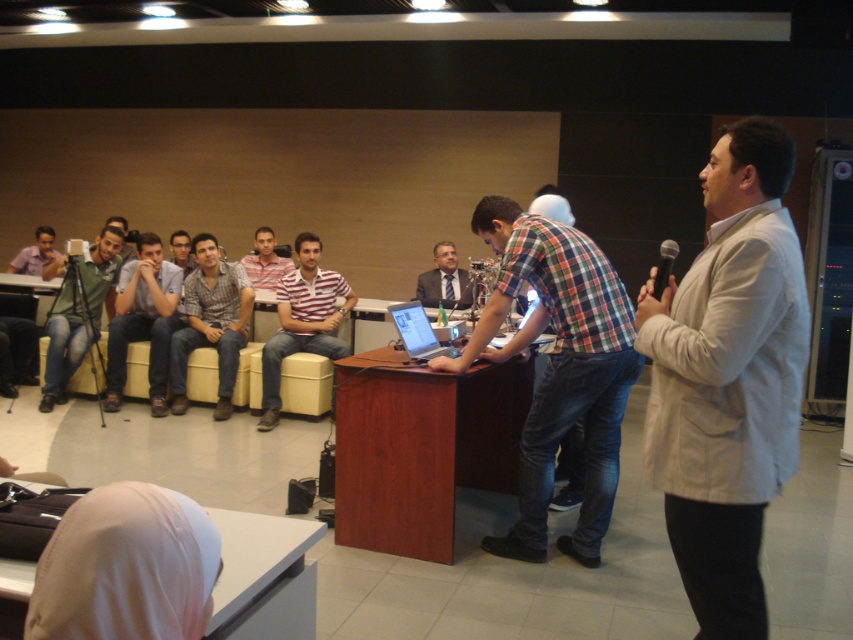
Question: Which of the following is the farthest from the observer?

Choices:
 (A) light blue shirt at center
 (B) beige fabric jacket at right
 (C) matte black suit at center
 (D) matte green shirt at left

Answer: (C)

Question: Is plaid fabric shirt at center thinner than plaid shirt at center?

Choices:
 (A) no
 (B) yes

Answer: (A)

Question: Is striped cotton shirt at center thinner than black plastic microphone at upper right?

Choices:
 (A) no
 (B) yes

Answer: (A)

Question: Is beige fabric jacket at right to the left of black plastic microphone at upper right from the viewer's perspective?

Choices:
 (A) yes
 (B) no

Answer: (A)

Question: Estimate the real-world distances between objects in this image. Which object is closer to the plaid fabric shirt at center?

Choices:
 (A) plaid shirt at center
 (B) matte black suit at center

Answer: (B)

Question: Which object is farther from the camera taking this photo?

Choices:
 (A) striped cotton shirt at center
 (B) plaid fabric shirt at center
 (C) matte green shirt at left
 (D) striped shirt at center

Answer: (D)